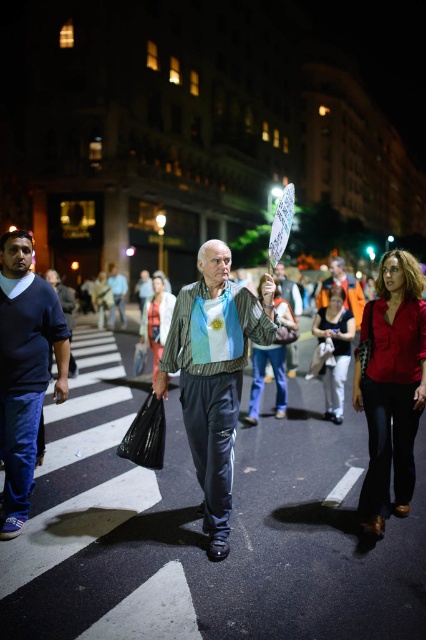
Does dark blue sweater at left appear under orange fabric shirt at center?

Yes.

Describe the element at coordinates (25, 369) in the screenshot. I see `dark blue sweater at left` at that location.

Which is in front, point (16, 284) or point (342, 260)?

Point (16, 284)

Identify the location of dark blue sweater at left. (25, 369).

Between point (9, 276) and point (298, 316), which one is positioned in front?

Point (9, 276) is in front.

Can you confirm if dark blue sweater at left is shorter than white paper sign at center?

In fact, dark blue sweater at left may be taller than white paper sign at center.

Which is in front, point (34, 321) or point (284, 275)?

Point (34, 321) is in front.

Locate an element on the screen. dark blue sweater at left is located at coordinates (25, 369).

Is striped fabric shirt at center positioned behind orange fabric shirt at center?

No, it is in front of orange fabric shirt at center.

Consider the image. Can you confirm if striped fabric shirt at center is positioned to the right of orange fabric shirt at center?

Incorrect, striped fabric shirt at center is not on the right side of orange fabric shirt at center.

Does point (227, 465) lie behind point (336, 272)?

That is False.

Find the location of a particular element. striped fabric shirt at center is located at coordinates (213, 376).